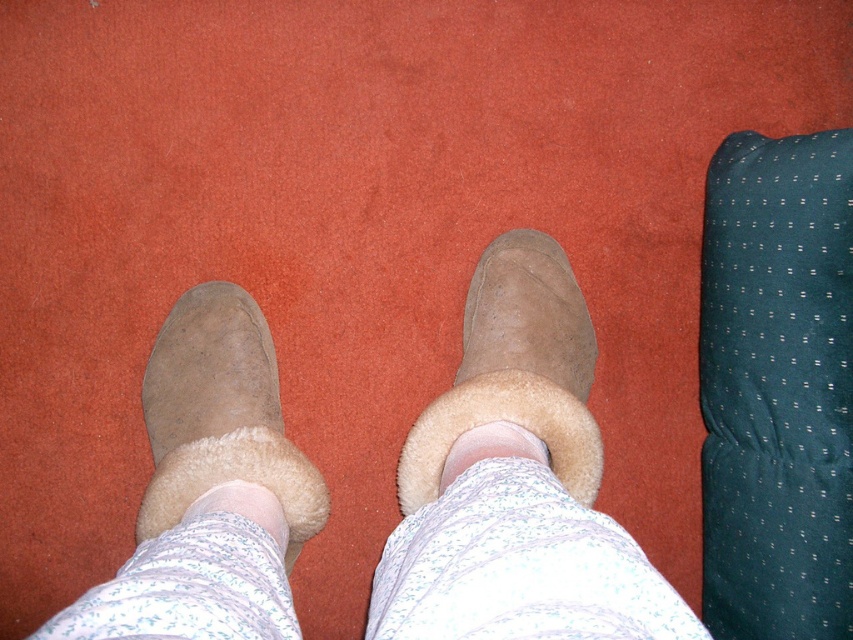
Question: Which point is closer to the camera taking this photo?

Choices:
 (A) (479, 433)
 (B) (747, 364)
 (C) (219, 500)
 (D) (316, 493)

Answer: (C)

Question: Which point is farther to the camera?

Choices:
 (A) (274, 481)
 (B) (439, 493)
 (C) (170, 349)

Answer: (C)

Question: Does suede/sheepskin boot at center appear on the left side of suede/sheepskin boot at lower left?

Choices:
 (A) no
 (B) yes

Answer: (A)

Question: Based on their relative distances, which object is farther from the white fluffy ankle at center?

Choices:
 (A) brown suede slippers at center
 (B) white fluffy sock at center
 (C) dark green dotted pillow at right
 (D) suede/sheepskin boot at lower left

Answer: (C)

Question: Does dark green dotted pillow at right have a lesser width compared to suede/sheepskin boot at lower left?

Choices:
 (A) yes
 (B) no

Answer: (A)

Question: Does brown suede slippers at center appear on the right side of suede/sheepskin boot at center?

Choices:
 (A) yes
 (B) no

Answer: (B)